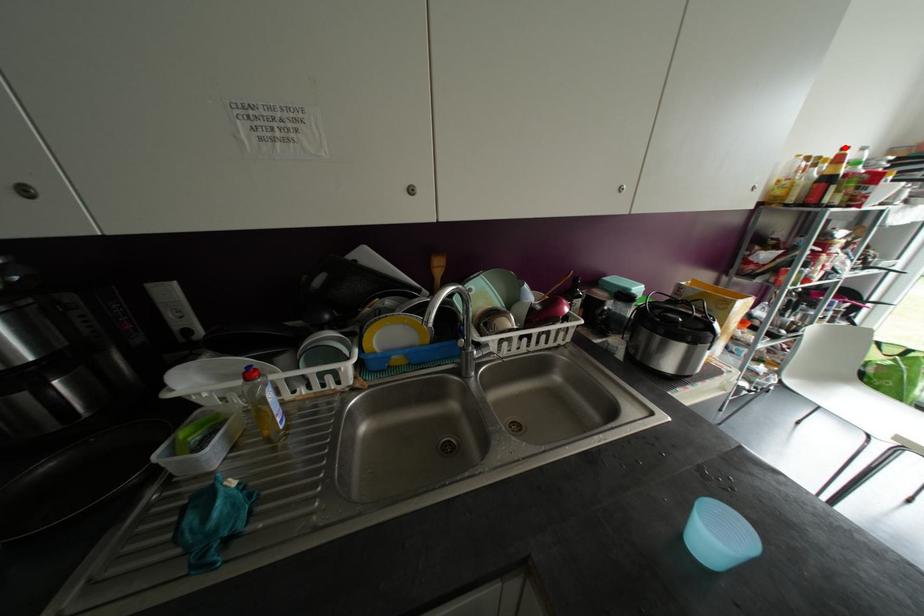
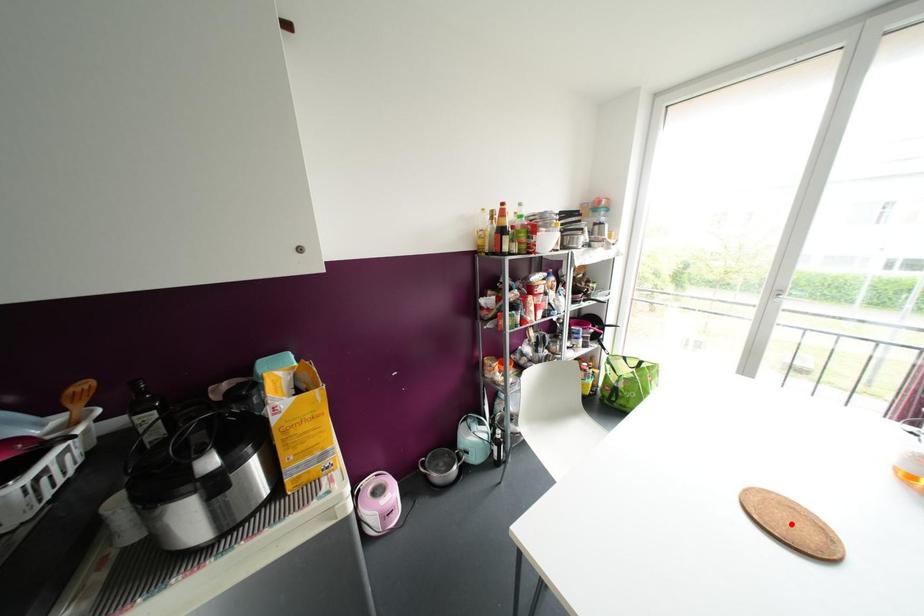
I am providing you with two images of the same scene from different viewpoints. A red point is marked on the first image and another point is marked on the second image. Are the points marked in image1 and image2 representing the same 3D position?

No